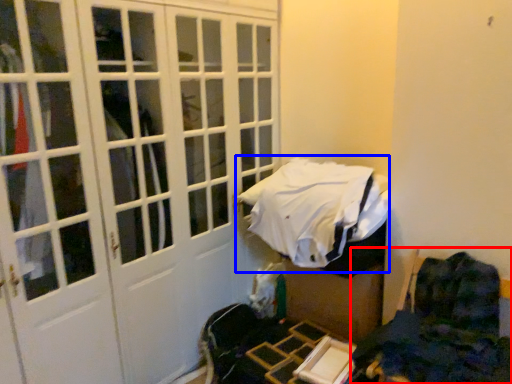
Question: Which object appears farthest to the camera in this image, furniture (highlighted by a red box) or bed (highlighted by a blue box)?

Choices:
 (A) furniture
 (B) bed

Answer: (B)